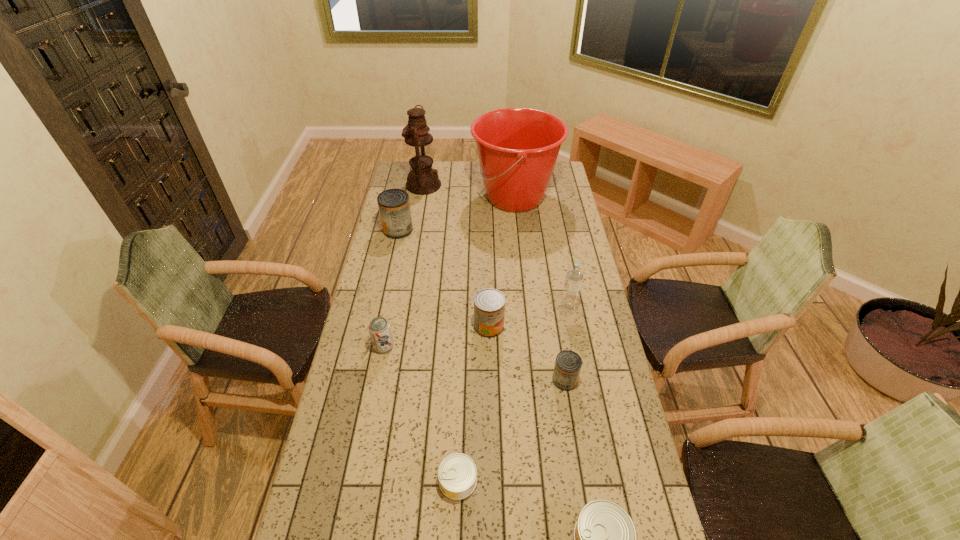
In order to click on vacant space that's between the oil lamp and the second tallest can in this screenshot , I will do `click(456, 255)`.

Where is `free space between the second nearest red can and the bucket`? free space between the second nearest red can and the bucket is located at coordinates (502, 262).

Locate an element on the screen. The image size is (960, 540). empty space that is in between the sixth farthest object and the red bucket is located at coordinates (449, 272).

Where is `unoccupied area between the red bucket and the sixth shortest object`? unoccupied area between the red bucket and the sixth shortest object is located at coordinates (456, 214).

Find the location of `vacant area between the second nearest can and the red bucket`. vacant area between the second nearest can and the red bucket is located at coordinates (487, 339).

In order to click on object that stands as the fifth closest to the water bottle in this screenshot , I will do `click(457, 473)`.

The width and height of the screenshot is (960, 540). I want to click on the sixth closest object to the second farthest can, so click(x=517, y=148).

Locate which can ranks in proximity to the nearest object. Please provide its 2D coordinates. Your answer should be formatted as a tuple, i.e. [(x, y)], where the tuple contains the x and y coordinates of a point satisfying the conditions above.

[(457, 473)]

Locate an element on the screen. This screenshot has height=540, width=960. can that can be found as the third closest to the smallest red can is located at coordinates (605, 539).

Locate an element on the screen. The image size is (960, 540). the third closest red can to the oil lamp is located at coordinates (568, 364).